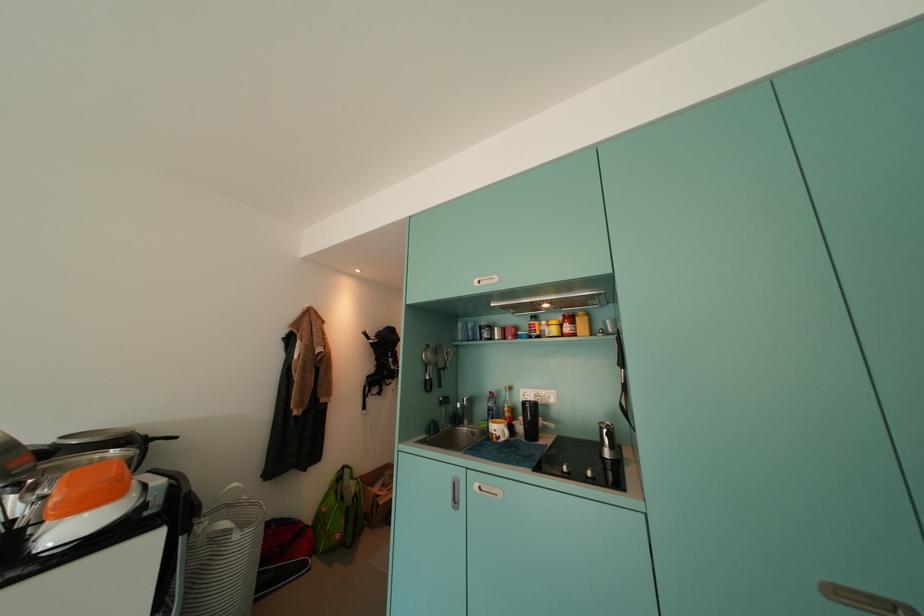
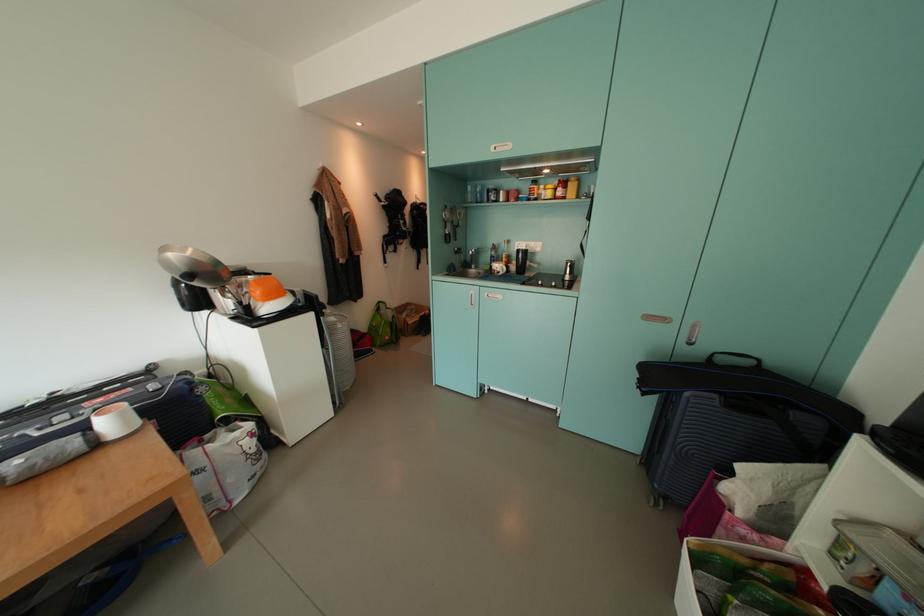
Question: How did the camera likely rotate?

Choices:
 (A) Left
 (B) Right
 (C) Up
 (D) Down

Answer: (D)